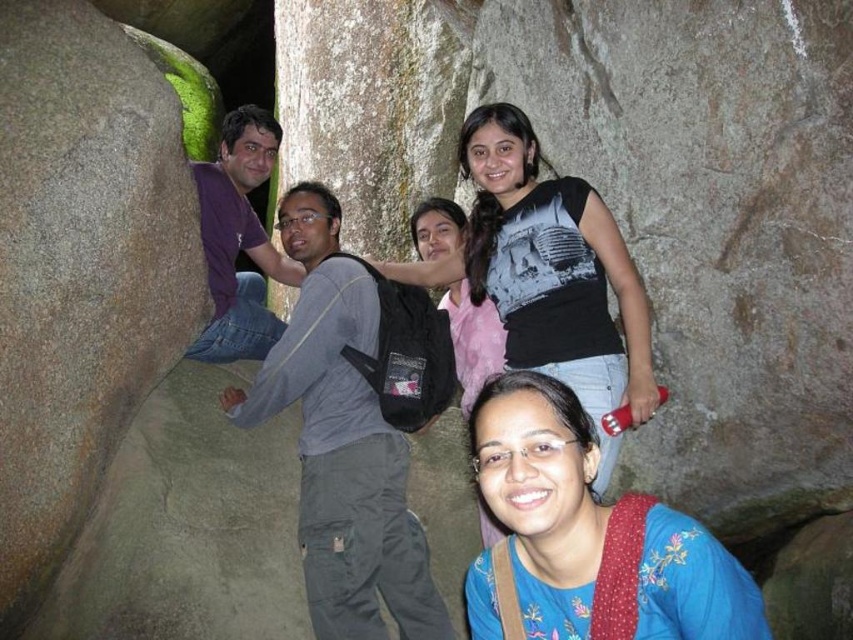
You are standing in the cave and want to place a small plant pot on the green mossy rock at center. Based on the coordinates provided, can you confirm if the rock is positioned in the lower half of the image?

The green mossy rock at center is located at point [634,196]. Since the y coordinate 0.744 is above 0.5, the rock is in the upper half of the image, so the plant pot cannot be placed there if the lower half is required.

You are a photographer trying to adjust your camera focus. You notice two points in the image at coordinates point (x=763, y=170) and point (x=668, y=608). Which point should you focus on first if you want to ensure the closest object is sharp?

Point (x=763, y=170) is closer to the camera than point (x=668, y=608), so you should focus on point (x=763, y=170) first to ensure the closest object is sharp.

You are standing in the cave and want to place a small decoration between the two points, point (189, 228) and point (585, 531). Which point is closer to you so you can start placing the decoration from there?

Point (189, 228) is closer to you than point (585, 531), so you can start placing the decoration from there.